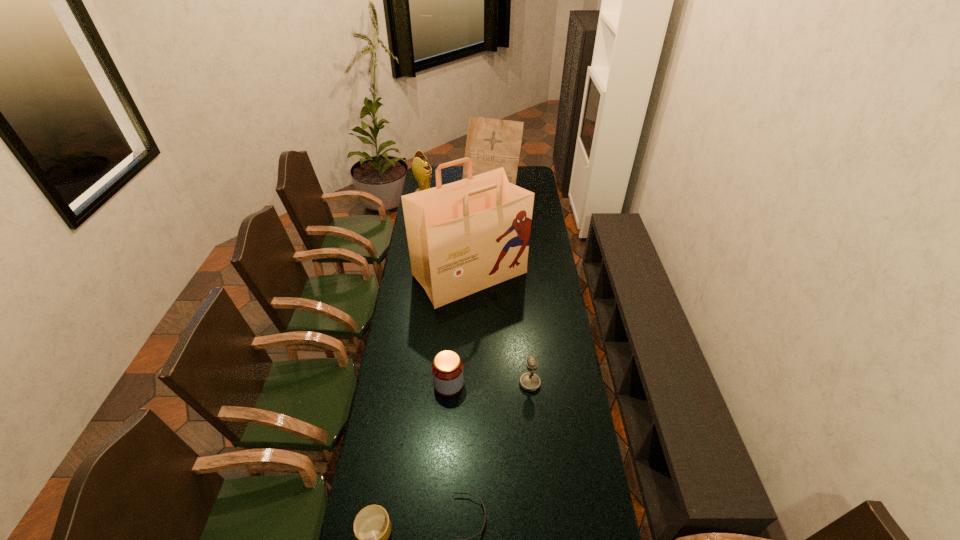
Identify the location of the third farthest object. Image resolution: width=960 pixels, height=540 pixels. (463, 237).

Locate an element on the screen. the tallest object is located at coordinates (463, 237).

This screenshot has height=540, width=960. Find the location of `the sixth shortest object`. the sixth shortest object is located at coordinates (491, 143).

Identify the location of the farther grocery bag. The image size is (960, 540). (491, 143).

Where is `the fifth shortest object`? This screenshot has height=540, width=960. the fifth shortest object is located at coordinates (421, 172).

I want to click on microphone, so click(x=529, y=381).

You are a GUI agent. You are given a task and a screenshot of the screen. Output one action in this format:
    pyautogui.click(x=<x>, y=<y>)
    Task: Click on the jar
    
    Given the screenshot: What is the action you would take?
    pyautogui.click(x=447, y=368)

The height and width of the screenshot is (540, 960). I want to click on vacant space located 0.280m on the side of the nearer grocery bag with the superhero design, so click(468, 361).

This screenshot has height=540, width=960. I want to click on free space located on the left of the farther grocery bag, so click(433, 186).

Locate an element on the screen. This screenshot has height=540, width=960. free point located on the front-facing side of the fifth shortest object is located at coordinates (498, 202).